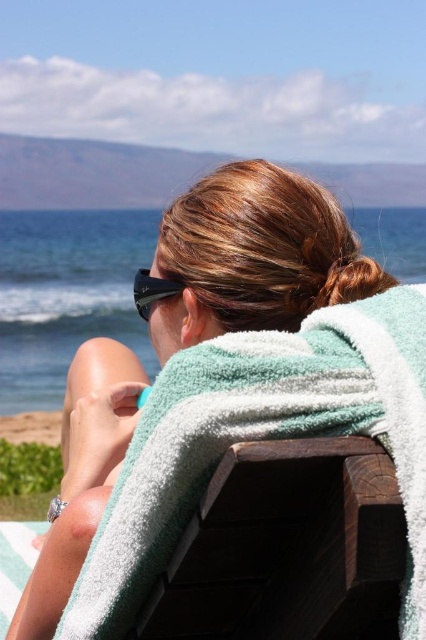
You are a photographer standing at the camera position. You want to capture a closeup shot of the green towel at center. Can you reach it without moving your feet?

The green towel at center is 3.33 feet away from the camera, so you can reach it without moving your feet since it is within arm reach.

You are a photographer taking a picture of the beach scene. You notice the green towel at center and the black matte sunglasses at center. Which object should you focus on if you want to capture the taller one in your shot?

The green towel at center is taller than the black matte sunglasses at center, so you should focus on the green towel at center to capture the taller object in your shot.